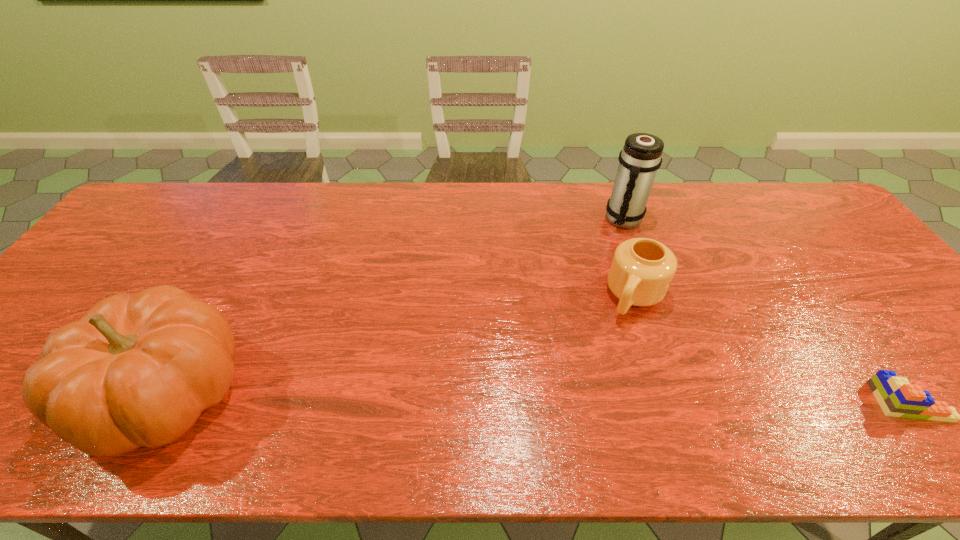
Locate an element on the screen. vacant space at the near edge of the desktop is located at coordinates [x=707, y=386].

The width and height of the screenshot is (960, 540). In order to click on free region at the right edge in this screenshot , I will do `click(823, 236)`.

The width and height of the screenshot is (960, 540). Identify the location of vacant space that's between the farthest object and the rightmost object. (766, 310).

Locate an element on the screen. This screenshot has height=540, width=960. unoccupied position between the thermos bottle and the shortest object is located at coordinates pos(766,310).

This screenshot has width=960, height=540. I want to click on free spot between the rightmost object and the leftmost object, so click(x=538, y=396).

Where is `free space between the mug and the pumpkin`? free space between the mug and the pumpkin is located at coordinates (401, 343).

You are a GUI agent. You are given a task and a screenshot of the screen. Output one action in this format:
    pyautogui.click(x=<x>, y=<y>)
    Task: Click on the empty location between the farthest object and the rightmost object
    
    Given the screenshot: What is the action you would take?
    (766, 310)

Image resolution: width=960 pixels, height=540 pixels. What are the coordinates of `free space between the second farthest object and the shortest object` in the screenshot? It's located at (772, 349).

This screenshot has height=540, width=960. Find the location of `free space between the leftmost object and the farthest object`. free space between the leftmost object and the farthest object is located at coordinates (396, 306).

I want to click on free spot between the shortest object and the thermos bottle, so click(x=766, y=310).